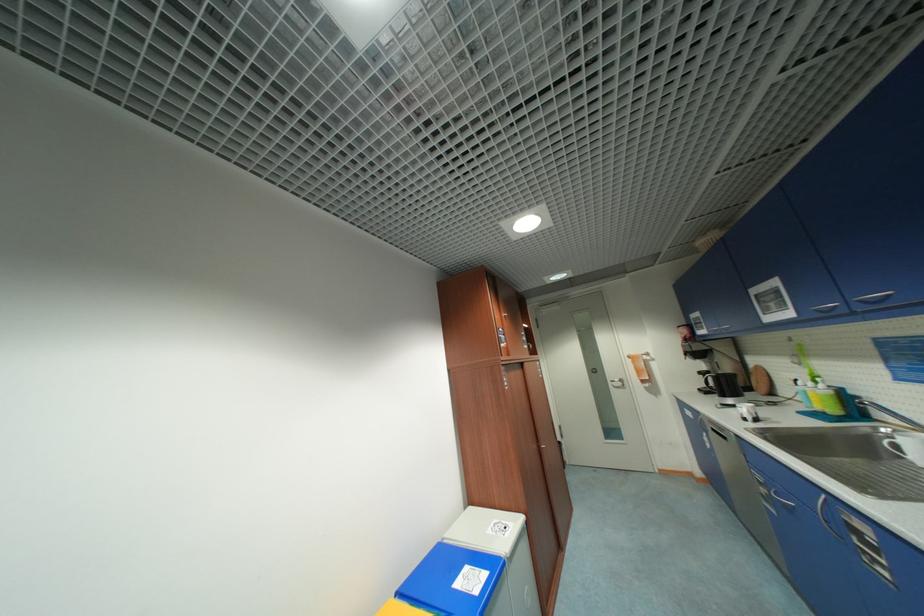
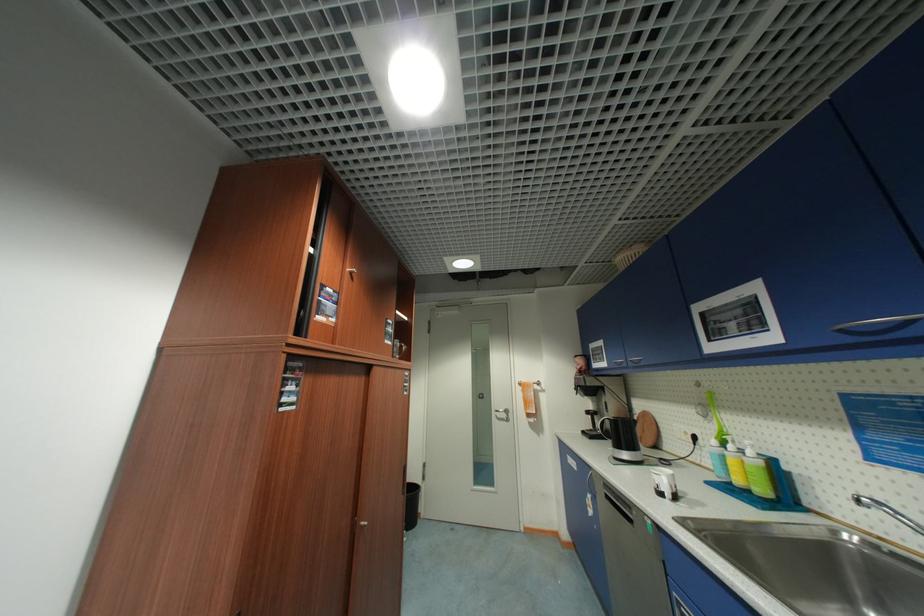
In the second image, find the point that corresponds to the point at 809,410 in the first image.

(719, 479)